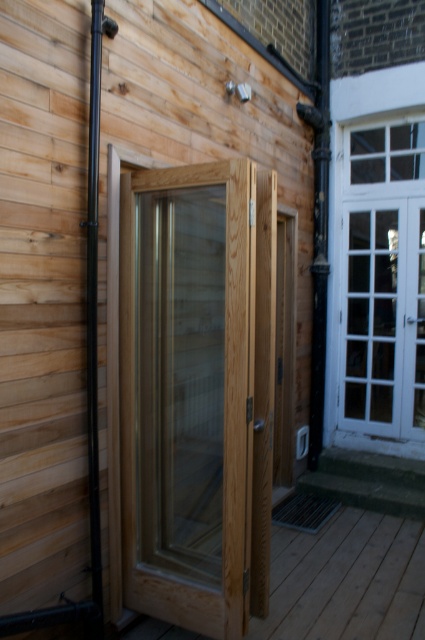
You are a delivery person trying to enter the building through the doors. The natural wood door at center is partially open, while the white glass door at upper right is closed. Which door should you use to enter?

You should use the natural wood door at center because it is partially open and taller than the white glass door at upper right, making it more accessible for entry.

You are a delivery person trying to enter the building through the doors. You see the natural wood door at center and the white glass door at upper right. Which door is closer to your left side when facing the building?

The natural wood door at center is positioned on the left side of white glass door at upper right, so it is closer to your left side when facing the building.